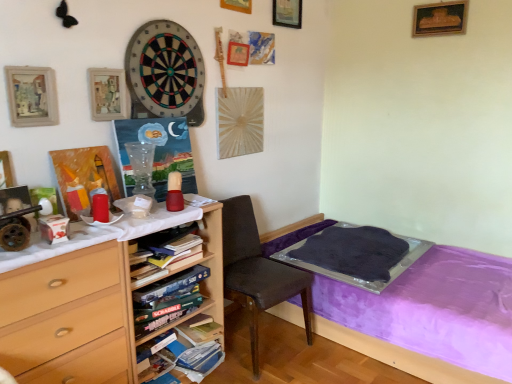
Find the location of a particular element. The width and height of the screenshot is (512, 384). free space above soft felt dartboard at upper center (from a real-world perspective) is located at coordinates (159, 11).